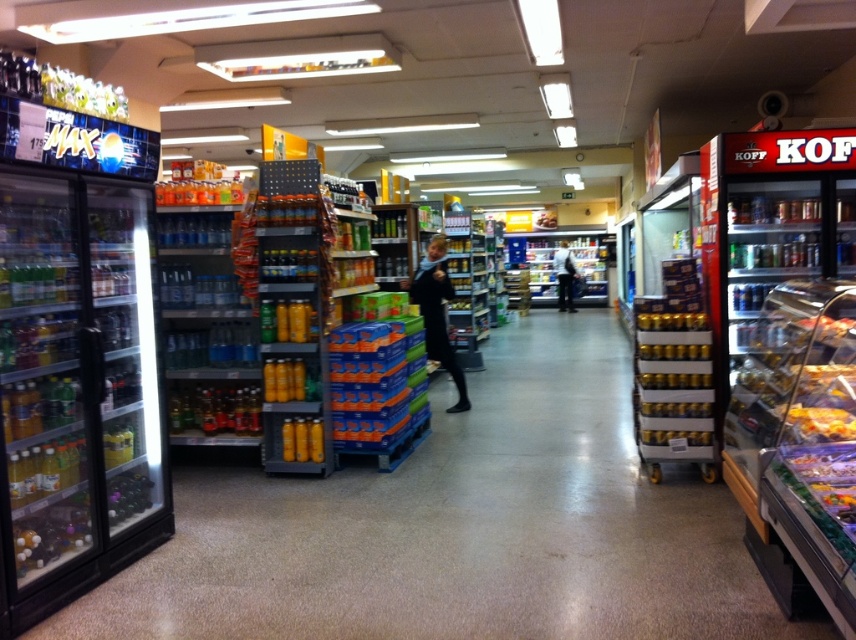
Question: Is black matte jacket at center further to camera compared to yellow matte can at center?

Choices:
 (A) no
 (B) yes

Answer: (B)

Question: Which point appears closest to the camera in this image?

Choices:
 (A) (669, 403)
 (B) (658, 436)

Answer: (B)

Question: Does black matte jacket at center come in front of yellow matte cans at center?

Choices:
 (A) no
 (B) yes

Answer: (A)

Question: Considering the real-world distances, which object is farthest from the yellow matte canisters at center?

Choices:
 (A) metallic gold cans at center-right
 (B) yellow matte cans at center
 (C) yellow plastic baguette at center right

Answer: (C)

Question: Is yellow plastic baguette at center right bigger than yellow matte cans at center?

Choices:
 (A) no
 (B) yes

Answer: (B)

Question: Among these objects, which one is farthest from the camera?

Choices:
 (A) yellow plastic baguette at center right
 (B) metallic gold cans at center-right
 (C) yellow matte canisters at center
 (D) yellow matte can at center

Answer: (B)